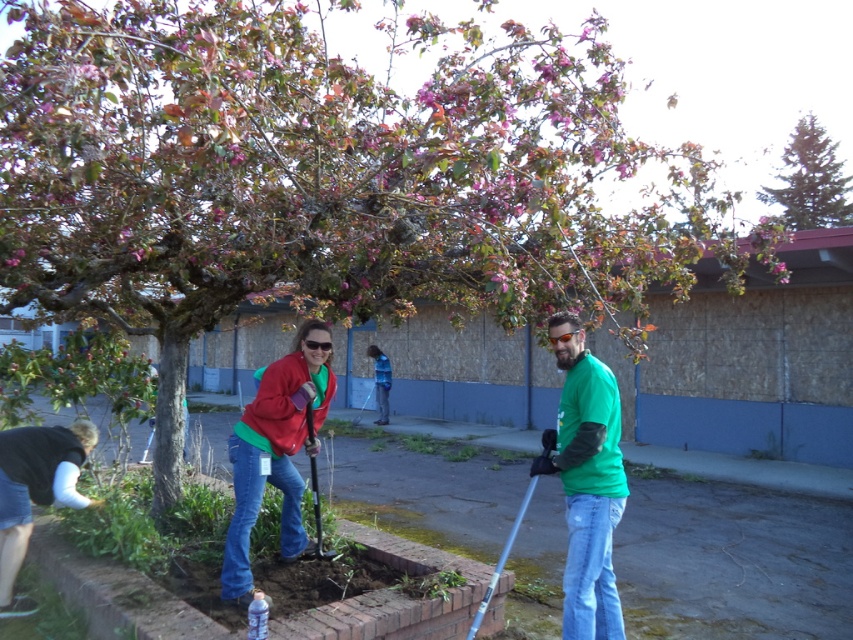
Who is shorter, silver metallic shovel at center or blue denim jeans at center?

silver metallic shovel at center is shorter.

Does silver metallic shovel at center have a smaller size compared to blue denim jeans at center?

Incorrect, silver metallic shovel at center is not smaller in size than blue denim jeans at center.

Is point (509, 531) less distant than point (386, 397)?

Yes, it is.

Where is `silver metallic shovel at center`? This screenshot has height=640, width=853. silver metallic shovel at center is located at coordinates (502, 560).

Can you confirm if green textured evergreen tree at upper right is thinner than metallic silver shovel at center?

In fact, green textured evergreen tree at upper right might be wider than metallic silver shovel at center.

Who is positioned more to the right, green textured evergreen tree at upper right or metallic silver shovel at center?

From the viewer's perspective, green textured evergreen tree at upper right appears more on the right side.

Who is more distant from viewer, (817, 125) or (329, 554)?

The point (817, 125) is more distant.

At what (x,y) coordinates should I click in order to perform the action: click on green textured evergreen tree at upper right. Please return your answer as a coordinate pair (x, y). The image size is (853, 640). Looking at the image, I should click on (810, 180).

Can you confirm if metallic silver shovel at center is positioned below orange reflective goggles at center?

Yes, metallic silver shovel at center is below orange reflective goggles at center.

Which is in front, point (314, 554) or point (575, 328)?

Point (575, 328) is more forward.

Does point (310, 424) come farther from viewer compared to point (579, 330)?

Yes, it is.

The width and height of the screenshot is (853, 640). In order to click on metallic silver shovel at center in this screenshot , I will do `click(317, 515)`.